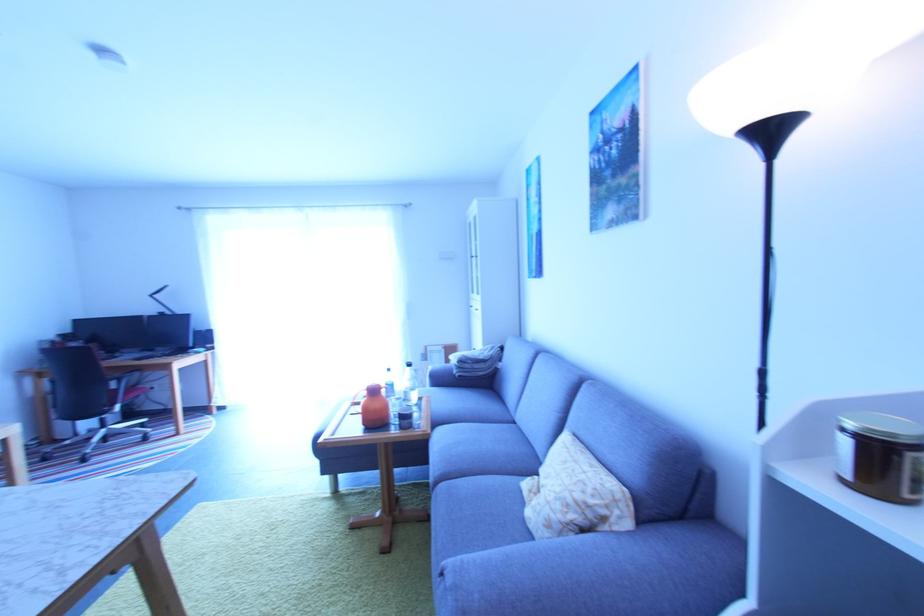
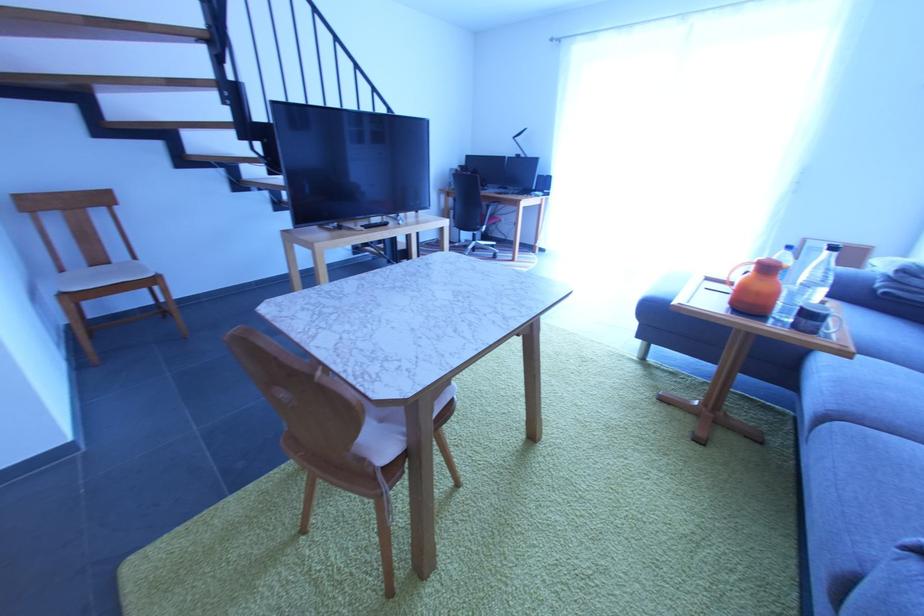
Where in the second image is the point corresponding to [415,429] from the first image?

(819, 334)